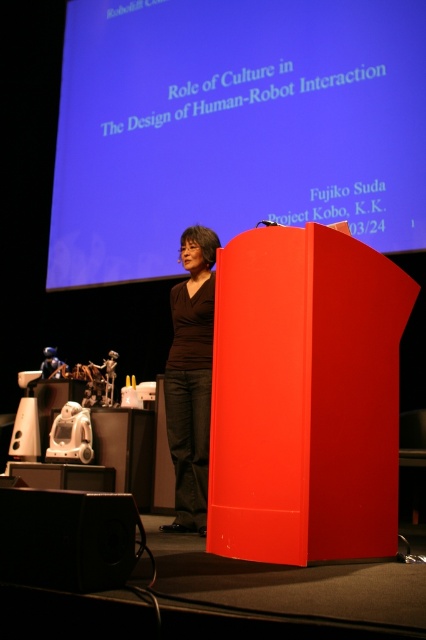
From the picture: Can you confirm if black matte speaker at lower left is positioned to the left of brown matte shirt at center?

Yes, black matte speaker at lower left is to the left of brown matte shirt at center.

Looking at this image, between black matte speaker at lower left and brown matte shirt at center, which one has less height?

Standing shorter between the two is black matte speaker at lower left.

Which is in front, point (55, 529) or point (186, 243)?

Positioned in front is point (55, 529).

Identify the location of black matte speaker at lower left. (68, 538).

Based on the photo, is blue matte projection screen at upper center taller than brown matte shirt at center?

Yes, blue matte projection screen at upper center is taller than brown matte shirt at center.

What do you see at coordinates (233, 125) in the screenshot?
I see `blue matte projection screen at upper center` at bounding box center [233, 125].

Identify the location of blue matte projection screen at upper center. The height and width of the screenshot is (640, 426). (233, 125).

Does blue matte projection screen at upper center have a larger size compared to black matte speaker at lower left?

Yes.

Between point (385, 198) and point (20, 548), which one is positioned behind?

The point (385, 198) is more distant.

Where is `blue matte projection screen at upper center`? blue matte projection screen at upper center is located at coordinates [x=233, y=125].